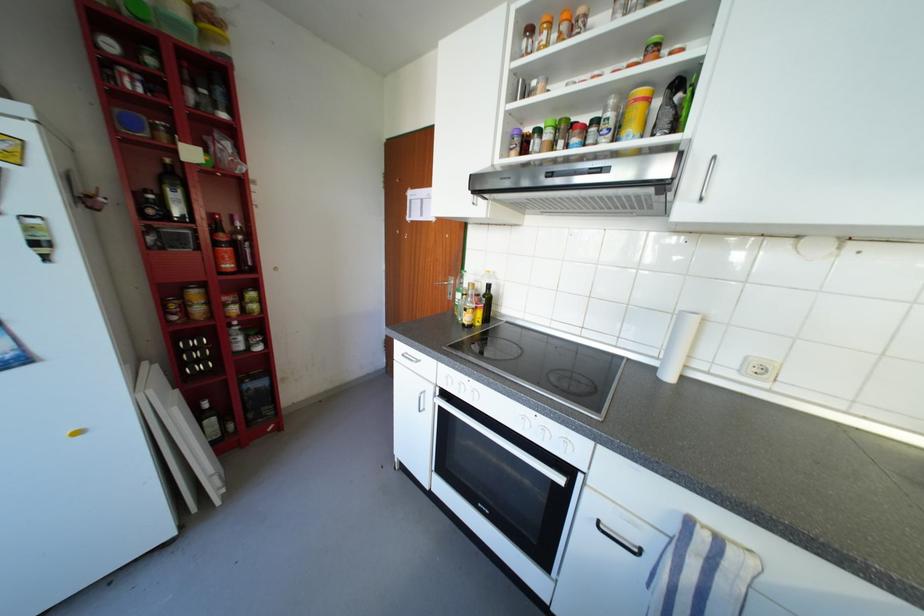
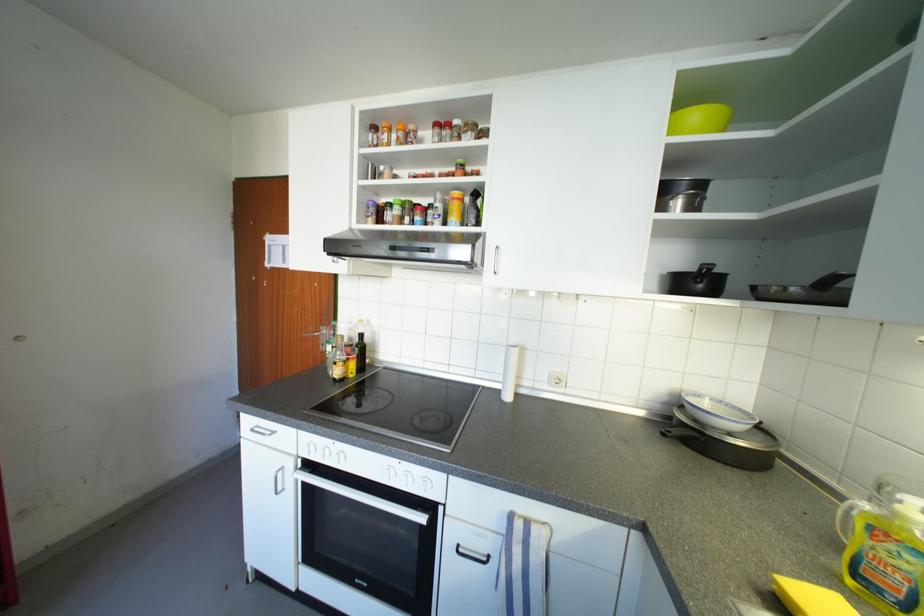
Question: The camera is either moving clockwise (left) or counter-clockwise (right) around the object. The first image is from the beginning of the video and the second image is from the end. Is the camera moving left or right when shooting the video?

Choices:
 (A) Left
 (B) Right

Answer: (A)